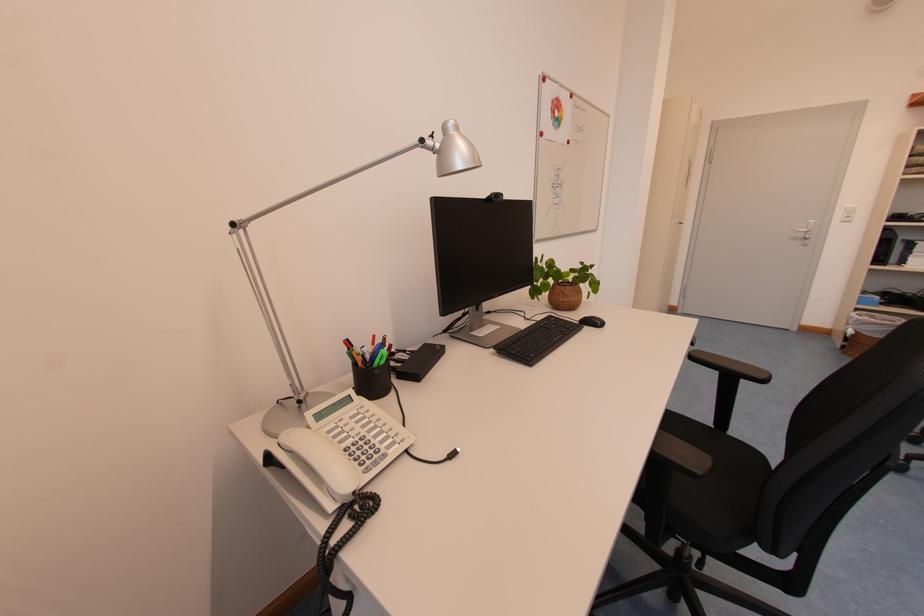
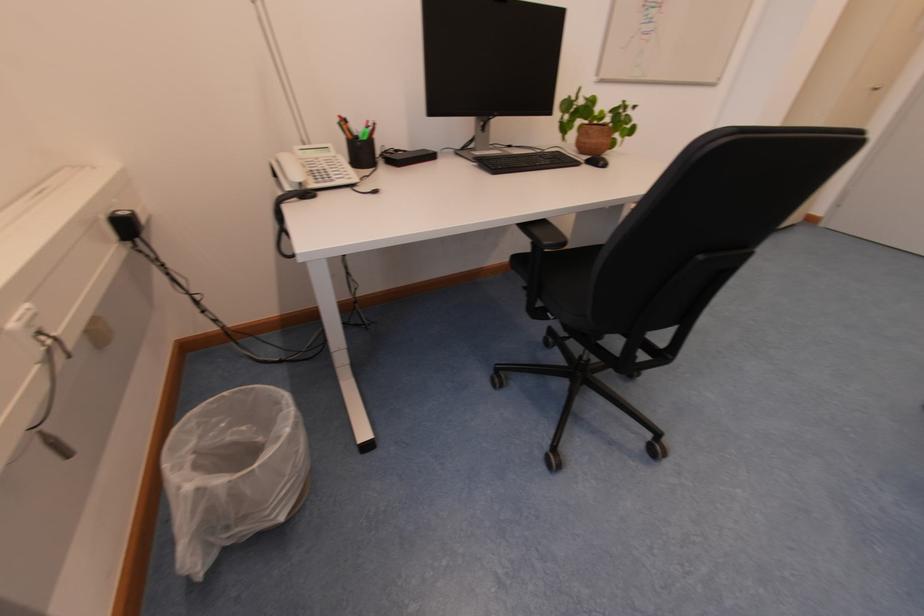
Find the pixel in the second image that matches (382,339) in the first image.

(375, 124)